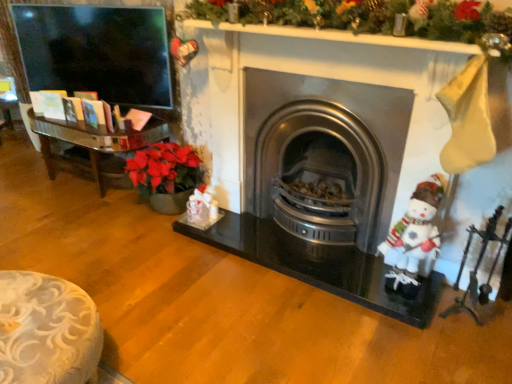
Question: Is white fabric santa claus at right at the left side of metallic silver fireplace tools at right?

Choices:
 (A) yes
 (B) no

Answer: (A)

Question: Is white fabric santa claus at right in front of metallic silver fireplace tools at right?

Choices:
 (A) no
 (B) yes

Answer: (A)

Question: Is white fabric santa claus at right placed right next to metallic silver fireplace tools at right?

Choices:
 (A) no
 (B) yes

Answer: (A)

Question: Can you confirm if white fabric santa claus at right is thinner than metallic silver fireplace tools at right?

Choices:
 (A) no
 (B) yes

Answer: (B)

Question: From a real-world perspective, is white fabric santa claus at right on top of metallic silver fireplace tools at right?

Choices:
 (A) yes
 (B) no

Answer: (A)

Question: Does white fabric santa claus at right have a larger size compared to metallic silver fireplace tools at right?

Choices:
 (A) yes
 (B) no

Answer: (A)

Question: Considering the relative positions of metallic silver fireplace tools at right and white fabric santa claus at right in the image provided, is metallic silver fireplace tools at right behind white fabric santa claus at right?

Choices:
 (A) no
 (B) yes

Answer: (A)

Question: Is metallic silver fireplace tools at right aimed at white fabric santa claus at right?

Choices:
 (A) no
 (B) yes

Answer: (A)

Question: Can you confirm if metallic silver fireplace tools at right is wider than white fabric santa claus at right?

Choices:
 (A) yes
 (B) no

Answer: (A)

Question: Is metallic silver fireplace tools at right beside white fabric santa claus at right?

Choices:
 (A) yes
 (B) no

Answer: (B)

Question: From a real-world perspective, does metallic silver fireplace tools at right sit lower than white fabric santa claus at right?

Choices:
 (A) no
 (B) yes

Answer: (B)

Question: Does metallic silver fireplace tools at right appear on the right side of white fabric santa claus at right?

Choices:
 (A) yes
 (B) no

Answer: (A)

Question: Can you confirm if white fabric santa claus at right is bigger than stainless steel wood burning stove at center?

Choices:
 (A) yes
 (B) no

Answer: (B)